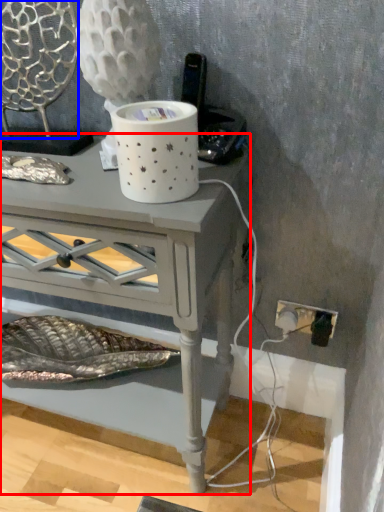
Question: Among these objects, which one is farthest to the camera, table (highlighted by a red box) or swivel chair (highlighted by a blue box)?

Choices:
 (A) table
 (B) swivel chair

Answer: (B)